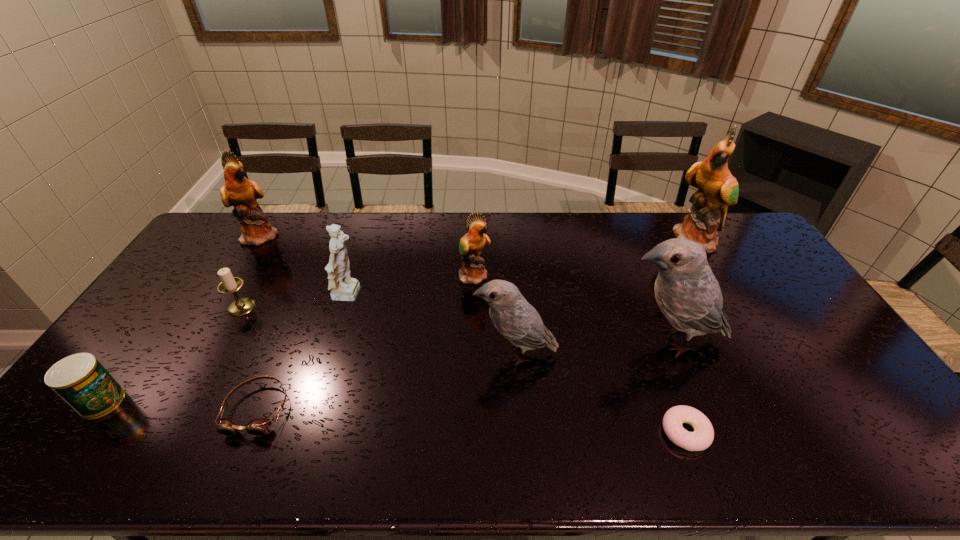
At what (x,y) coordinates should I click in order to perform the action: click on free region at the far left corner of the desktop. Please return your answer as a coordinate pair (x, y). Looking at the image, I should click on (215, 222).

The height and width of the screenshot is (540, 960). What are the coordinates of `vacant region at the far right corner of the desktop` in the screenshot? It's located at (726, 246).

This screenshot has height=540, width=960. I want to click on vacant region between the ninth tallest object and the white candle holder, so click(x=250, y=358).

The width and height of the screenshot is (960, 540). I want to click on vacant area that lies between the left gray parrot and the white candle holder, so click(378, 330).

Where is `vacant space that's between the second biggest green parrot and the ninth tallest object`? This screenshot has width=960, height=540. vacant space that's between the second biggest green parrot and the ninth tallest object is located at coordinates [x=259, y=322].

You are a GUI agent. You are given a task and a screenshot of the screen. Output one action in this format:
    pyautogui.click(x=<x>, y=<y>)
    Task: Click on the vacant space that's between the doughnut and the bigger gray parrot
    This screenshot has height=540, width=960.
    Given the screenshot: What is the action you would take?
    pyautogui.click(x=678, y=386)

Where is `empty space between the tallest parrot and the sixth object from right to left`? empty space between the tallest parrot and the sixth object from right to left is located at coordinates (523, 268).

Where is `empty location between the second biggest green parrot and the bigger gray parrot`? The image size is (960, 540). empty location between the second biggest green parrot and the bigger gray parrot is located at coordinates (466, 288).

Find the location of a particular element. vacant area that lies between the candle holder and the leftmost parrot is located at coordinates click(x=252, y=271).

Find the location of a particular element. The width and height of the screenshot is (960, 540). vacant area that lies between the leftmost object and the smallest green parrot is located at coordinates (288, 339).